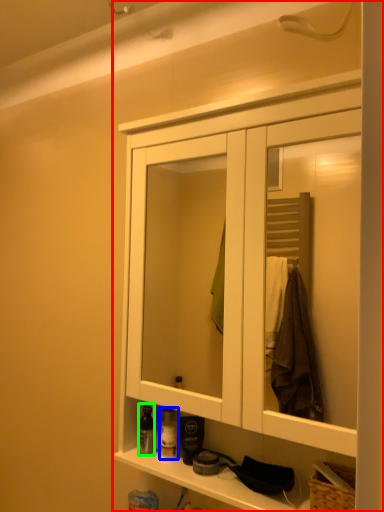
Question: Which object is the closest to the cabinetry (highlighted by a red box)? Choose among these: toiletry (highlighted by a blue box) or toiletry (highlighted by a green box).

Choices:
 (A) toiletry
 (B) toiletry

Answer: (B)